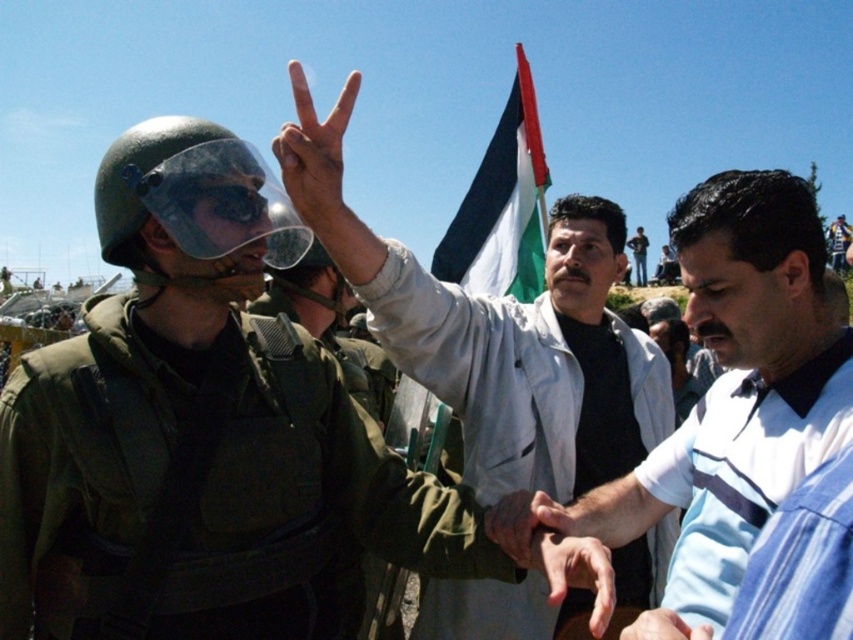
Which is more to the left, matte green helmet at upper left or smooth skin hand at center?

Positioned to the left is matte green helmet at upper left.

Which is in front, point (143, 198) or point (666, 618)?

Point (666, 618) is in front.

What do you see at coordinates (202, 440) in the screenshot? The image size is (853, 640). I see `matte green helmet at upper left` at bounding box center [202, 440].

Identify the location of matte green helmet at upper left. (202, 440).

Can you confirm if matte green helmet at upper left is bigger than white striped polo shirt at center?

Incorrect, matte green helmet at upper left is not larger than white striped polo shirt at center.

Between point (172, 280) and point (553, 529), which one is positioned behind?

Positioned behind is point (172, 280).

Where is `matte green helmet at upper left`? Image resolution: width=853 pixels, height=640 pixels. matte green helmet at upper left is located at coordinates (202, 440).

Locate an element on the screen. The height and width of the screenshot is (640, 853). matte green helmet at upper left is located at coordinates (202, 440).

Does point (259, 422) lie in front of point (113, 250)?

No.

Image resolution: width=853 pixels, height=640 pixels. I want to click on matte green helmet at upper left, so click(202, 440).